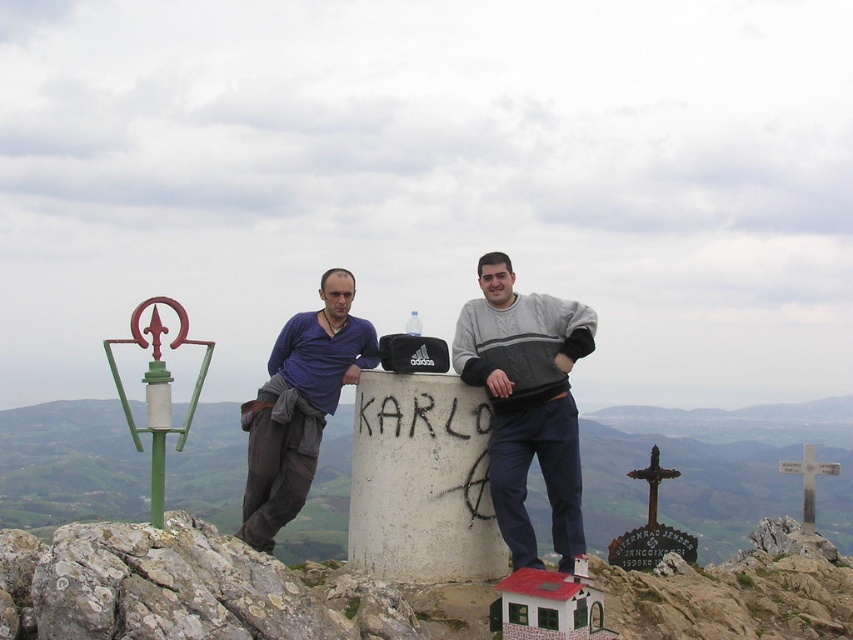
Question: Can you confirm if gray sweater at center is positioned below blue cotton shirt at center?

Choices:
 (A) no
 (B) yes

Answer: (A)

Question: Which of these objects is positioned farthest from the gray sweater at center?

Choices:
 (A) white concrete cylinder at center
 (B) blue cotton shirt at center

Answer: (A)

Question: Can you confirm if gray sweater at center is positioned above blue cotton shirt at center?

Choices:
 (A) yes
 (B) no

Answer: (A)

Question: Which point is farther from the camera taking this photo?

Choices:
 (A) (259, 420)
 (B) (677, 612)

Answer: (A)

Question: Estimate the real-world distances between objects in this image. Which object is closer to the blue cotton shirt at center?

Choices:
 (A) gray sweater at center
 (B) white concrete cylinder at center

Answer: (A)

Question: Is gray sweater at center below blue cotton shirt at center?

Choices:
 (A) yes
 (B) no

Answer: (B)